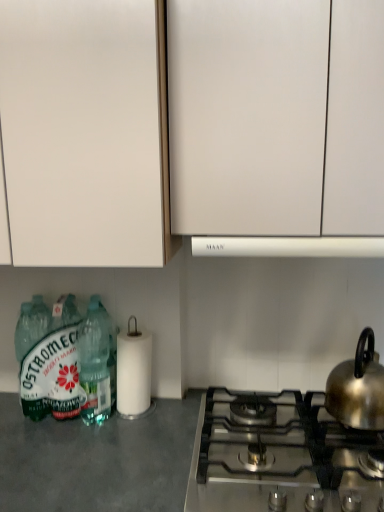
Identify the location of vacant space situated on the left part of shiny metallic kettle at right. The height and width of the screenshot is (512, 384). pos(297,423).